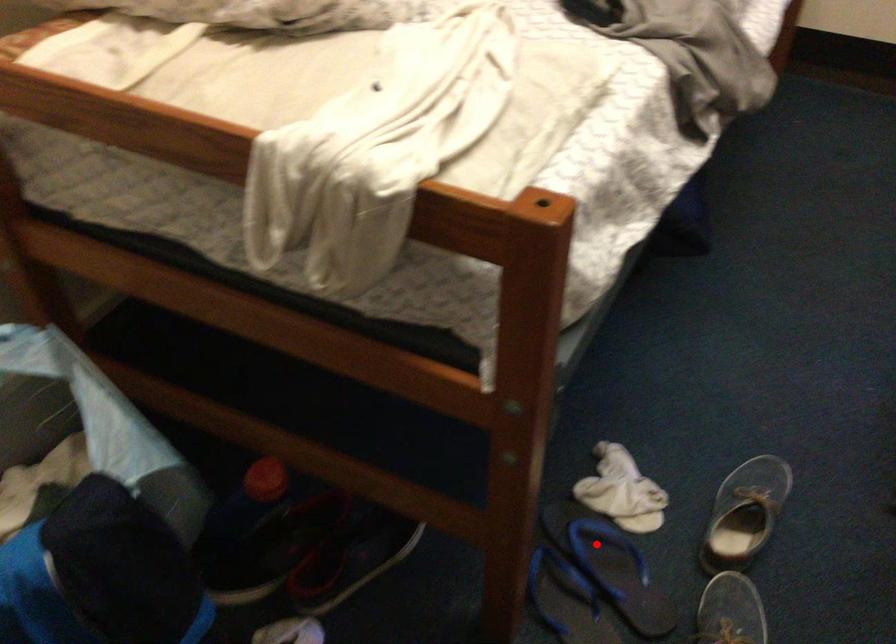
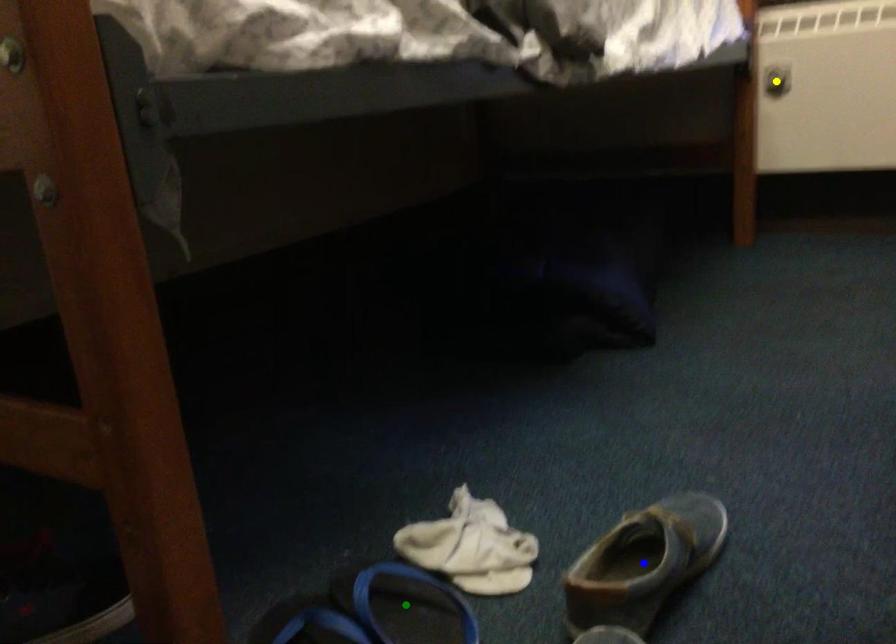
Question: I am providing you with two images of the same scene from different viewpoints. A red point is marked on the first image. You are given multiple points on the second image. In image 2, which mark is for the same physical point as the one in image 1?

Choices:
 (A) blue point
 (B) green point
 (C) yellow point

Answer: (B)